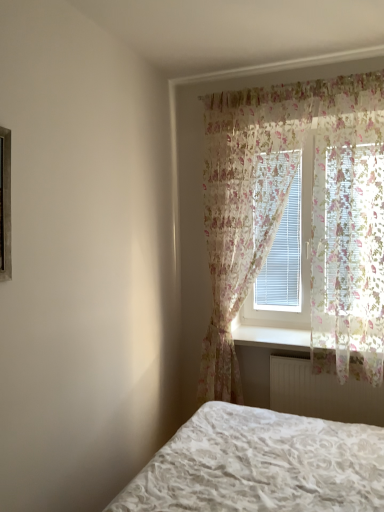
Question: From a real-world perspective, is white plastic radiator at lower center below floral sheer curtain at center, which appears as the second curtain when viewed from the right?

Choices:
 (A) no
 (B) yes

Answer: (B)

Question: From the image's perspective, would you say white plastic radiator at lower center is shown under floral sheer curtain at center, which appears as the second curtain when viewed from the right?

Choices:
 (A) no
 (B) yes

Answer: (B)

Question: Are white plastic radiator at lower center and floral sheer curtain at center, which appears as the second curtain when viewed from the right, beside each other?

Choices:
 (A) no
 (B) yes

Answer: (A)

Question: Can you confirm if white plastic radiator at lower center is positioned to the left of floral sheer curtain at center, which appears as the 1th curtain when viewed from the left?

Choices:
 (A) no
 (B) yes

Answer: (A)

Question: Is white plastic radiator at lower center oriented away from floral sheer curtain at center, which appears as the 1th curtain when viewed from the left?

Choices:
 (A) no
 (B) yes

Answer: (A)

Question: Does white plastic radiator at lower center have a greater height compared to floral sheer curtain at center, which appears as the 1th curtain when viewed from the left?

Choices:
 (A) no
 (B) yes

Answer: (A)

Question: From a real-world perspective, is white matte radiator at lower center located higher than white plastic radiator at lower center?

Choices:
 (A) no
 (B) yes

Answer: (A)

Question: Considering the relative sizes of white matte radiator at lower center and white plastic radiator at lower center in the image provided, is white matte radiator at lower center thinner than white plastic radiator at lower center?

Choices:
 (A) yes
 (B) no

Answer: (A)

Question: Is white matte radiator at lower center wider than white plastic radiator at lower center?

Choices:
 (A) no
 (B) yes

Answer: (A)

Question: Can you confirm if white matte radiator at lower center is shorter than white plastic radiator at lower center?

Choices:
 (A) no
 (B) yes

Answer: (A)

Question: Is white matte radiator at lower center facing away from white plastic radiator at lower center?

Choices:
 (A) no
 (B) yes

Answer: (A)

Question: Is white matte radiator at lower center touching white plastic radiator at lower center?

Choices:
 (A) yes
 (B) no

Answer: (B)

Question: Considering the relative sizes of floral sheer curtain at center, which appears as the second curtain when viewed from the right, and floral sheer curtain at upper right, which is counted as the second curtain, starting from the left, in the image provided, is floral sheer curtain at center, which appears as the second curtain when viewed from the right, taller than floral sheer curtain at upper right, which is counted as the second curtain, starting from the left,?

Choices:
 (A) yes
 (B) no

Answer: (A)